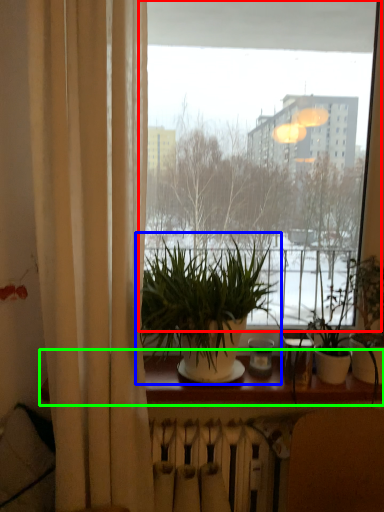
Question: Which object is positioned closest to window (highlighted by a red box)? Select from houseplant (highlighted by a blue box) and window sill (highlighted by a green box).

Choices:
 (A) houseplant
 (B) window sill

Answer: (A)